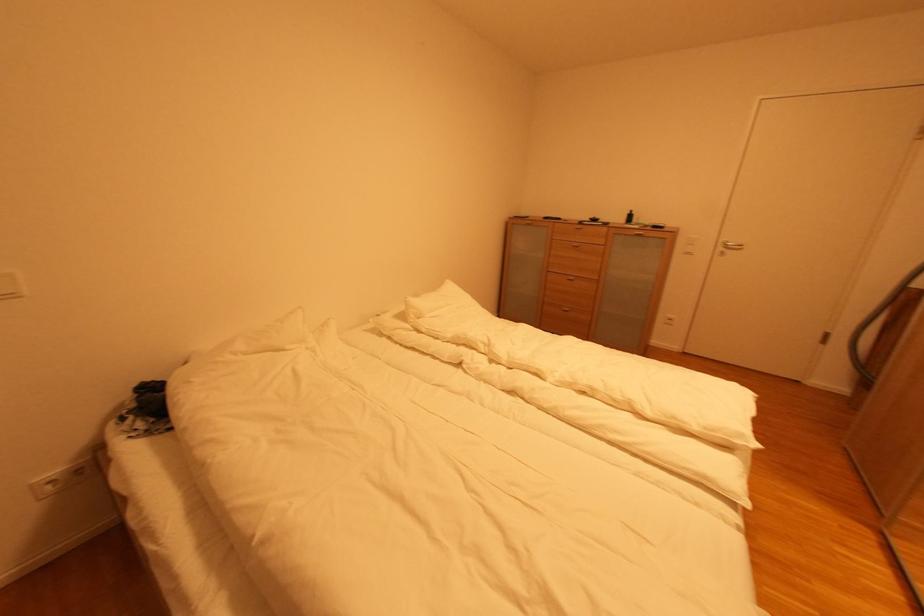
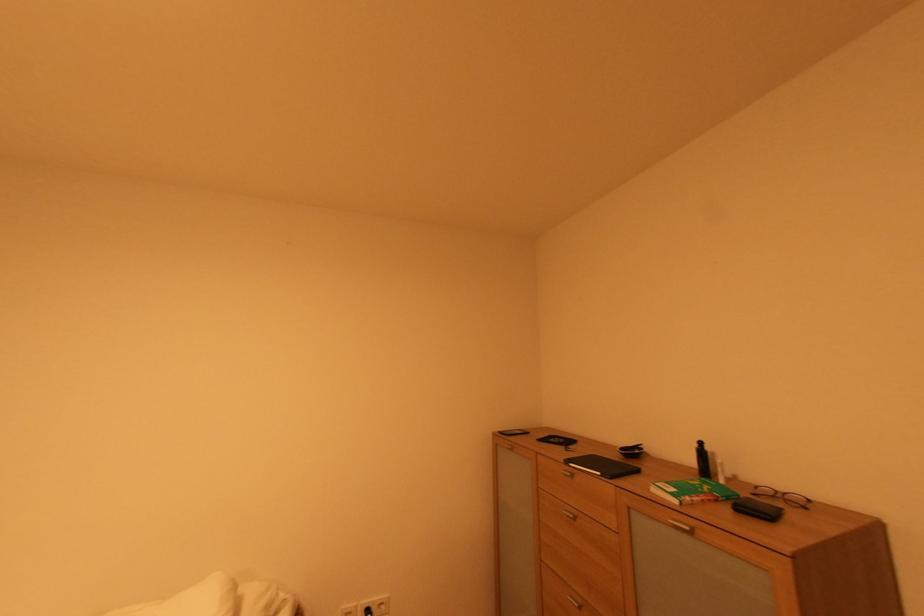
Locate, in the second image, the point that corresponds to (640,228) in the first image.

(682, 503)